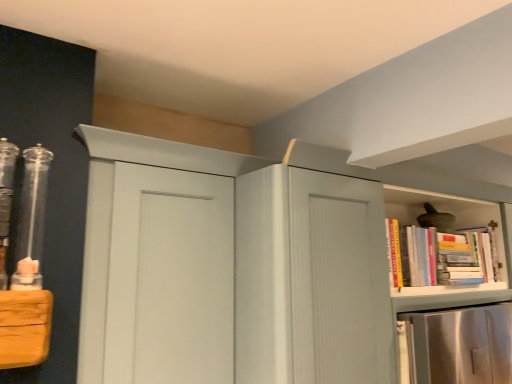
Question: From the image's perspective, is hardcover books at right located beneath matte white cupboard at center?

Choices:
 (A) yes
 (B) no

Answer: (B)

Question: Is hardcover books at right to the right of matte white cupboard at center from the viewer's perspective?

Choices:
 (A) yes
 (B) no

Answer: (A)

Question: Considering the relative sizes of hardcover books at right and matte white cupboard at center in the image provided, is hardcover books at right bigger than matte white cupboard at center?

Choices:
 (A) yes
 (B) no

Answer: (B)

Question: Is hardcover books at right to the left of matte white cupboard at center from the viewer's perspective?

Choices:
 (A) no
 (B) yes

Answer: (A)

Question: From the image's perspective, is hardcover books at right above matte white cupboard at center?

Choices:
 (A) no
 (B) yes

Answer: (B)

Question: Does hardcover books at right have a smaller size compared to matte white cupboard at center?

Choices:
 (A) yes
 (B) no

Answer: (A)

Question: Can you confirm if matte white cupboard at center is thinner than hardcover books at right?

Choices:
 (A) no
 (B) yes

Answer: (A)

Question: From a real-world perspective, is matte white cupboard at center positioned under hardcover books at right based on gravity?

Choices:
 (A) no
 (B) yes

Answer: (B)

Question: Does matte white cupboard at center have a larger size compared to hardcover books at right?

Choices:
 (A) no
 (B) yes

Answer: (B)

Question: Could you tell me if matte white cupboard at center is turned towards hardcover books at right?

Choices:
 (A) yes
 (B) no

Answer: (A)

Question: Can you confirm if matte white cupboard at center is positioned to the left of hardcover books at right?

Choices:
 (A) no
 (B) yes

Answer: (B)

Question: Is matte white cupboard at center smaller than hardcover books at right?

Choices:
 (A) no
 (B) yes

Answer: (A)

Question: In terms of size, does hardcover books at right appear bigger or smaller than matte white cupboard at center?

Choices:
 (A) big
 (B) small

Answer: (B)